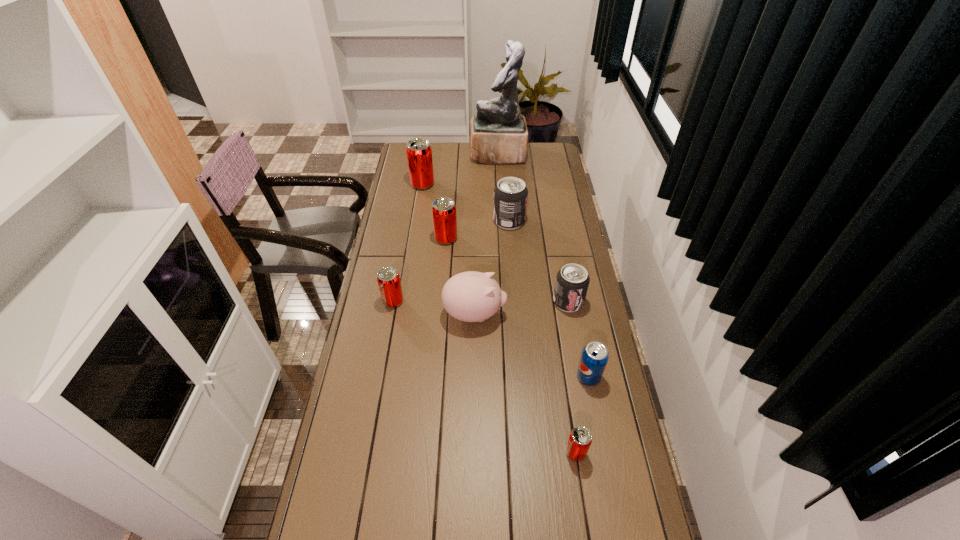
I want to click on vacant point that satisfies the following two spatial constraints: 1. in a relaxed pose on the nearest object; 2. on the right side of the sculpture, so click(x=514, y=453).

Where is `free location that satisfies the following two spatial constraints: 1. on the front side of the third soda can from left to right; 2. on the right side of the farthest soda can`? free location that satisfies the following two spatial constraints: 1. on the front side of the third soda can from left to right; 2. on the right side of the farthest soda can is located at coordinates (414, 239).